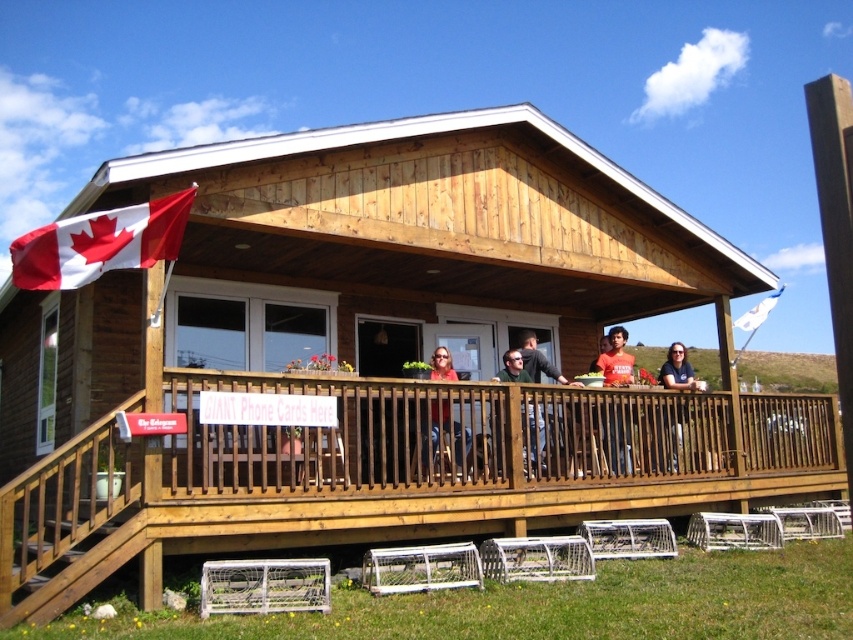
Can you confirm if brown wooden porch at upper center is positioned to the right of dark blue shirt at center?

In fact, brown wooden porch at upper center is to the left of dark blue shirt at center.

Does brown wooden porch at upper center have a lesser width compared to dark blue shirt at center?

Incorrect, brown wooden porch at upper center's width is not less than dark blue shirt at center's.

Who is more distant from viewer, (642, 506) or (676, 452)?

Positioned behind is point (676, 452).

Locate an element on the screen. The height and width of the screenshot is (640, 853). brown wooden porch at upper center is located at coordinates (386, 474).

Describe the element at coordinates (618, 436) in the screenshot. I see `matte orange t-shirt at center` at that location.

This screenshot has width=853, height=640. Identify the location of matte orange t-shirt at center. (618, 436).

Can you confirm if green fabric shirt at center is taller than dark gray shirt at center?

Yes.

At what (x,y) coordinates should I click in order to perform the action: click on green fabric shirt at center. Please return your answer as a coordinate pair (x, y). The width and height of the screenshot is (853, 640). Looking at the image, I should click on (537, 435).